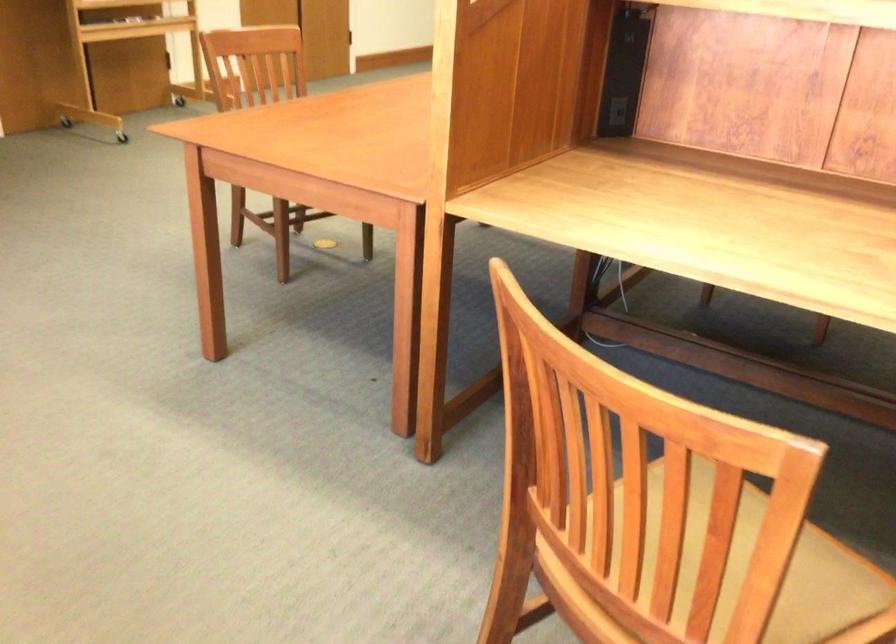
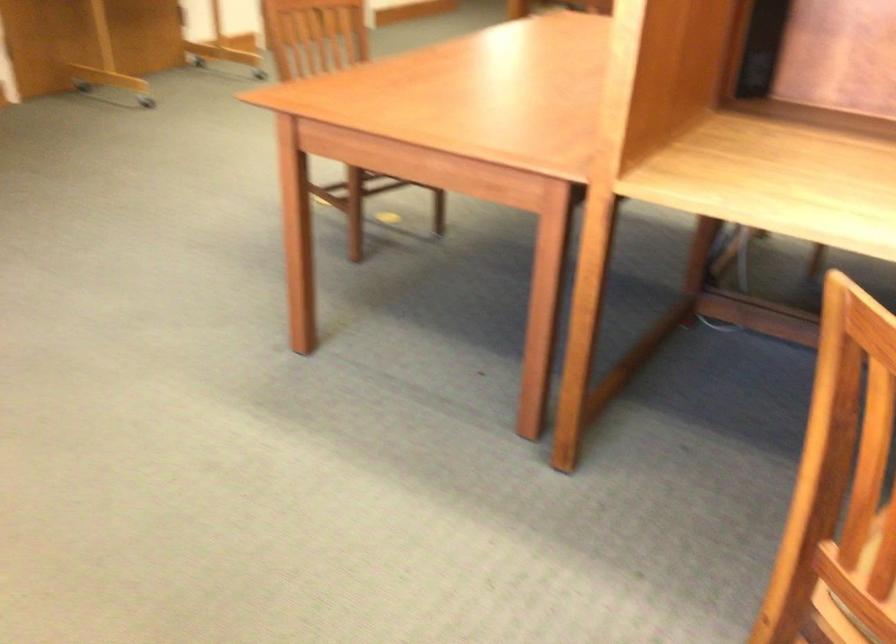
Question: How did the camera likely rotate?

Choices:
 (A) Left
 (B) Right
 (C) Up
 (D) Down

Answer: (D)